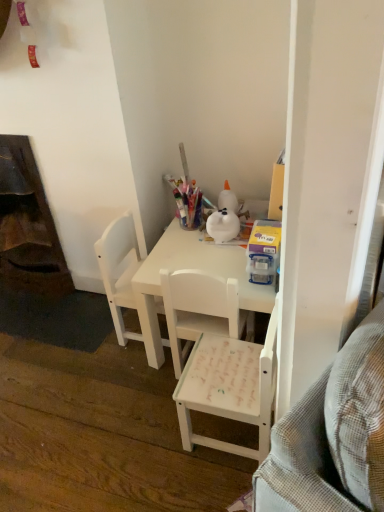
Locate an element on the screen. The image size is (384, 512). translucent plastic container at upper right is located at coordinates (263, 251).

Describe the element at coordinates (190, 268) in the screenshot. The image size is (384, 512). I see `white matte desk at center` at that location.

What do you see at coordinates (229, 387) in the screenshot? I see `white matte chair at center, which is counted as the 1th chair, starting from the right` at bounding box center [229, 387].

Where is `translucent plastic container at upper right`? translucent plastic container at upper right is located at coordinates (263, 251).

Between dark wood fireplace at left and white matte chair at center, which ranks as the 2th chair in left-to-right order, which one has larger size?

dark wood fireplace at left is bigger.

Looking at this image, how different are the orientations of dark wood fireplace at left and white matte chair at center, which ranks as the 2th chair in left-to-right order, in degrees?

They differ by 179 degrees in their facing directions.

Which is closer, (x=73, y=286) or (x=196, y=279)?

Positioned in front is point (x=196, y=279).

Looking at this image, is white matte desk at center completely or partially inside white matte chair at center, which is counted as the third chair, starting from the right?

No, white matte desk at center is located outside of white matte chair at center, which is counted as the third chair, starting from the right.

Is white matte chair at center, which is counted as the third chair, starting from the right, oriented towards white matte desk at center?

Yes, white matte chair at center, which is counted as the third chair, starting from the right, is facing white matte desk at center.

Considering the sizes of objects white matte chair at center, acting as the first chair starting from the left, and white matte desk at center in the image provided, who is wider, white matte chair at center, acting as the first chair starting from the left, or white matte desk at center?

Wider between the two is white matte desk at center.

From the picture: Is there a large distance between white matte chair at center, acting as the first chair starting from the left, and white matte desk at center?

They are positioned close to each other.

Is white matte chair at center, which is counted as the 1th chair, starting from the right, next to translucent plastic container at upper right?

They are not placed beside each other.

Which object is closer to the camera, white matte chair at center, which is counted as the 1th chair, starting from the right, or translucent plastic container at upper right?

white matte chair at center, which is counted as the 1th chair, starting from the right, is closer to the camera.

Is white matte chair at center, which is the 3th chair in left-to-right order, not inside translucent plastic container at upper right?

white matte chair at center, which is the 3th chair in left-to-right order, lies outside translucent plastic container at upper right's area.

Is point (210, 360) closer to camera compared to point (273, 245)?

Yes, it is in front of point (273, 245).

Starting from the dark wood fireplace at left, which chair is the 1st one in front? Please provide its 2D coordinates.

[(119, 271)]

Is white matte chair at center, which is counted as the third chair, starting from the right, facing towards dark wood fireplace at left?

No, white matte chair at center, which is counted as the third chair, starting from the right, is not aimed at dark wood fireplace at left.

Is white matte chair at center, acting as the first chair starting from the left, surrounding dark wood fireplace at left?

No.

Between white matte chair at center, which is counted as the third chair, starting from the right, and dark wood fireplace at left, which one has smaller width?

With smaller width is dark wood fireplace at left.

Between point (266, 236) and point (180, 423), which one is positioned behind?

The point (180, 423) is farther.

From the picture: Can you confirm if translucent plastic container at upper right is shorter than white matte chair at center, which is the 3th chair in left-to-right order?

Indeed, translucent plastic container at upper right has a lesser height compared to white matte chair at center, which is the 3th chair in left-to-right order.

Where is `the 3rd chair located beneath the translucent plastic container at upper right (from a real-world perspective)`? the 3rd chair located beneath the translucent plastic container at upper right (from a real-world perspective) is located at coordinates (229, 387).

From a real-world perspective, which object stands above the other?

In real-world perspective, translucent plastic container at upper right is above.

In the scene shown: Is dark wood fireplace at left not inside translucent plastic container at upper right?

That's correct, dark wood fireplace at left is outside of translucent plastic container at upper right.

Which of these two, dark wood fireplace at left or translucent plastic container at upper right, stands taller?

With more height is dark wood fireplace at left.

At what (x,y) coordinates should I click in order to perform the action: click on box that appears above the dark wood fireplace at left (from a real-world perspective). Please return your answer as a coordinate pair (x, y). Looking at the image, I should click on (263, 251).

Which is behind, dark wood fireplace at left or translucent plastic container at upper right?

dark wood fireplace at left is behind.

In the image, is translucent plastic container at upper right positioned in front of or behind white matte chair at center, which ranks as the 2th chair in left-to-right order?

Visually, translucent plastic container at upper right is located behind white matte chair at center, which ranks as the 2th chair in left-to-right order.

Between translucent plastic container at upper right and white matte chair at center, placed as the second chair when sorted from right to left, which one has larger width?

Wider between the two is white matte chair at center, placed as the second chair when sorted from right to left.

Based on their positions, is translucent plastic container at upper right located to the left or right of white matte chair at center, which ranks as the 2th chair in left-to-right order?

translucent plastic container at upper right is positioned on white matte chair at center, which ranks as the 2th chair in left-to-right order,'s right side.

Which chair is the 2nd one when counting from the right side of the dark wood fireplace at left? Please provide its 2D coordinates.

[(200, 310)]

Which chair is the 3rd one when counting from the left side of the white matte desk at center? Please provide its 2D coordinates.

[(119, 271)]

Consider the image. From the image, which object appears to be farther from dark wood fireplace at left, white matte chair at center, placed as the second chair when sorted from right to left, or translucent plastic container at upper right?

translucent plastic container at upper right.

Considering their positions, is white matte desk at center positioned closer to dark wood fireplace at left than white matte chair at center, which is counted as the third chair, starting from the right?

Among the two, white matte chair at center, which is counted as the third chair, starting from the right, is located nearer to dark wood fireplace at left.

Considering their positions, is white matte chair at center, which is the 3th chair in left-to-right order, positioned closer to white matte chair at center, placed as the second chair when sorted from right to left, than white matte desk at center?

Based on the image, white matte desk at center appears to be nearer to white matte chair at center, placed as the second chair when sorted from right to left.

From the image, which object appears to be farther from white matte chair at center, placed as the second chair when sorted from right to left, white matte desk at center or white matte chair at center, which is counted as the 1th chair, starting from the right?

white matte chair at center, which is counted as the 1th chair, starting from the right, lies further to white matte chair at center, placed as the second chair when sorted from right to left, than the other object.

From the image, which object appears to be nearer to translucent plastic container at upper right, dark wood fireplace at left or white matte desk at center?

white matte desk at center.

Looking at the image, which one is located further to dark wood fireplace at left, white matte chair at center, placed as the second chair when sorted from right to left, or white matte desk at center?

white matte chair at center, placed as the second chair when sorted from right to left, is positioned further to the anchor dark wood fireplace at left.

When comparing their distances from white matte chair at center, acting as the first chair starting from the left, does dark wood fireplace at left or white matte desk at center seem further?

Among the two, dark wood fireplace at left is located further to white matte chair at center, acting as the first chair starting from the left.

Which object lies nearer to the anchor point white matte chair at center, acting as the first chair starting from the left, dark wood fireplace at left or white matte chair at center, which ranks as the 2th chair in left-to-right order?

Based on the image, white matte chair at center, which ranks as the 2th chair in left-to-right order, appears to be nearer to white matte chair at center, acting as the first chair starting from the left.

Find the location of `desk between white matte chair at center, which is counted as the third chair, starting from the right, and translucent plastic container at upper right, in the horizontal direction`. desk between white matte chair at center, which is counted as the third chair, starting from the right, and translucent plastic container at upper right, in the horizontal direction is located at coordinates (190, 268).

Where is `chair situated between dark wood fireplace at left and white matte chair at center, placed as the second chair when sorted from right to left, from left to right`? The height and width of the screenshot is (512, 384). chair situated between dark wood fireplace at left and white matte chair at center, placed as the second chair when sorted from right to left, from left to right is located at coordinates (119, 271).

Where is `desk between white matte chair at center, which is counted as the 1th chair, starting from the right, and white matte chair at center, acting as the first chair starting from the left, in the front-back direction`? This screenshot has height=512, width=384. desk between white matte chair at center, which is counted as the 1th chair, starting from the right, and white matte chair at center, acting as the first chair starting from the left, in the front-back direction is located at coordinates (190, 268).

Locate an element on the screen. Image resolution: width=384 pixels, height=512 pixels. desk between translucent plastic container at upper right and white matte chair at center, placed as the second chair when sorted from right to left, from top to bottom is located at coordinates (190, 268).